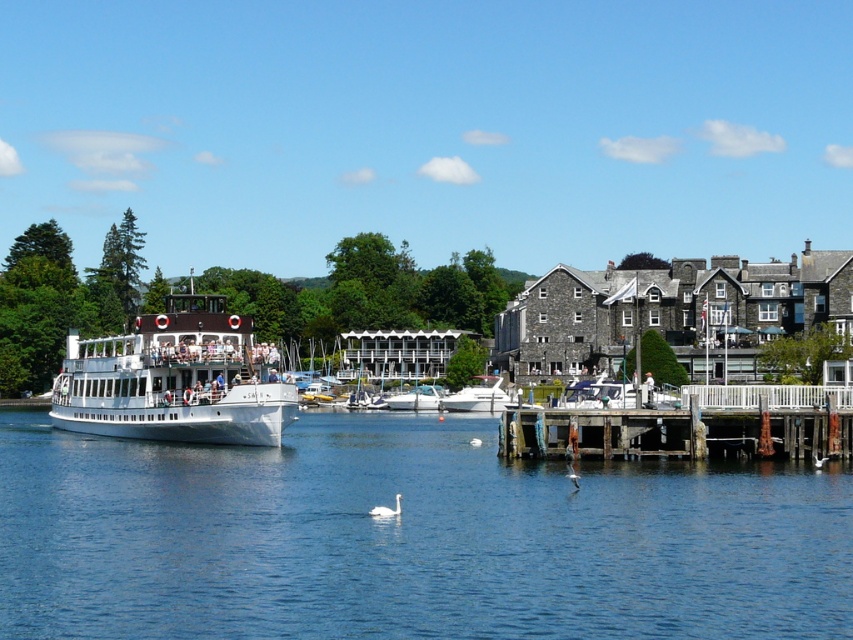
You are a tour guide planning a boat tour. The boat you will use has a length of 40 feet. You want to navigate the boat between the white glossy ferry at left and the clear blue water at center. Is there enough space for the boat to pass through?

The distance between the white glossy ferry at left and the clear blue water at center is 46.10 feet, which is greater than the boat length of 40 feet. Therefore, the boat can safely pass through the space between them.